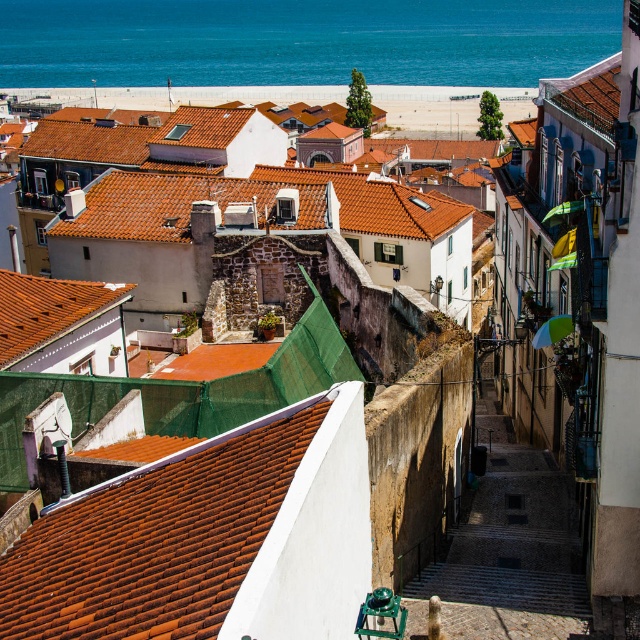
Question: Estimate the real-world distances between objects in this image. Which object is farther from the blue water at upper center?

Choices:
 (A) orange tiled roof at center
 (B) stone textured stairs at center
 (C) white sand beach at center
 (D) brown tile roof at lower left

Answer: (B)

Question: Is the position of blue water at upper center more distant than that of stone textured stairs at center?

Choices:
 (A) no
 (B) yes

Answer: (B)

Question: Which point is closer to the camera?

Choices:
 (A) (36, 356)
 (B) (186, 182)
 (C) (209, 620)
 (D) (131, 102)

Answer: (C)

Question: Is the position of white sand beach at center more distant than that of orange tiled roof at center-left?

Choices:
 (A) no
 (B) yes

Answer: (B)

Question: Is orange tiled roof at center closer to camera compared to white sand beach at center?

Choices:
 (A) yes
 (B) no

Answer: (A)

Question: Which point is farther to the camera?

Choices:
 (A) orange tiled roof at center-left
 (B) white sand beach at center
 (C) orange tiled roof at center

Answer: (B)